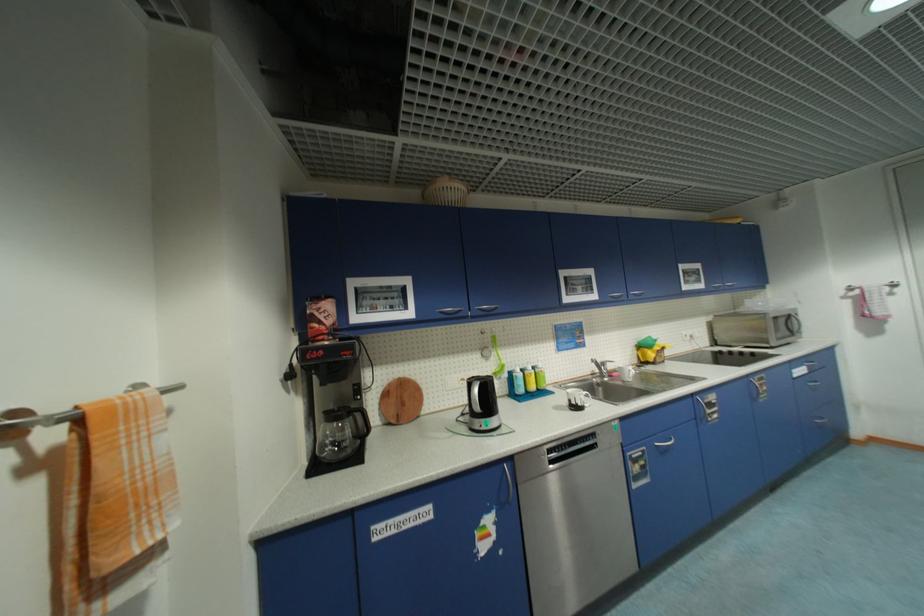
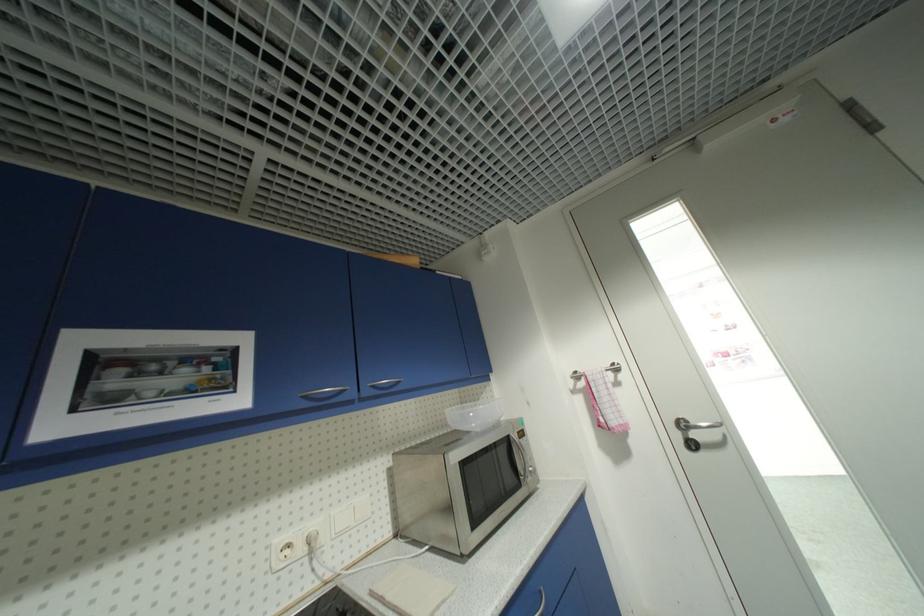
The point at (795, 317) is marked in the first image. Where is the corresponding point in the second image?

(514, 440)